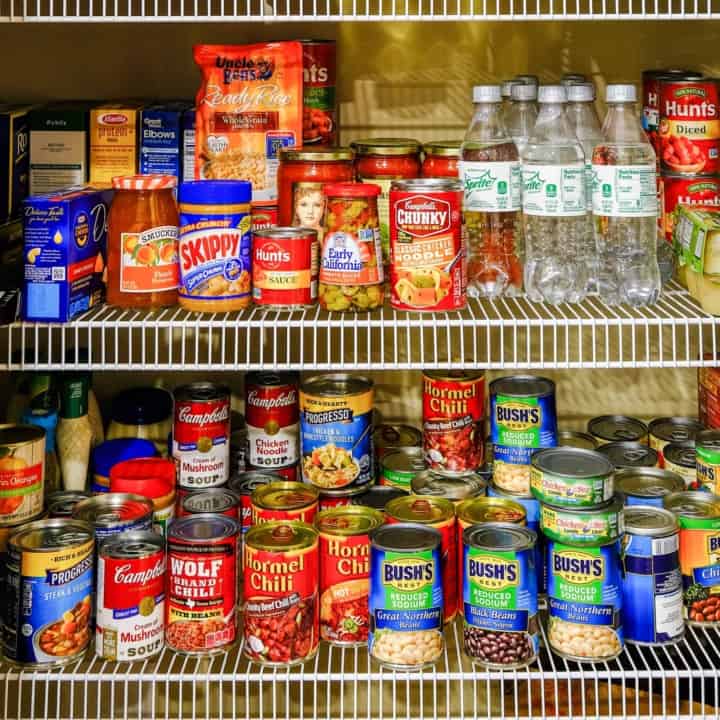
The image size is (720, 720). I want to click on bottles of sprite, so 620,242, 585,127, 526,117, 495,132, 531,80, 577,76, 569,80, 508,91.